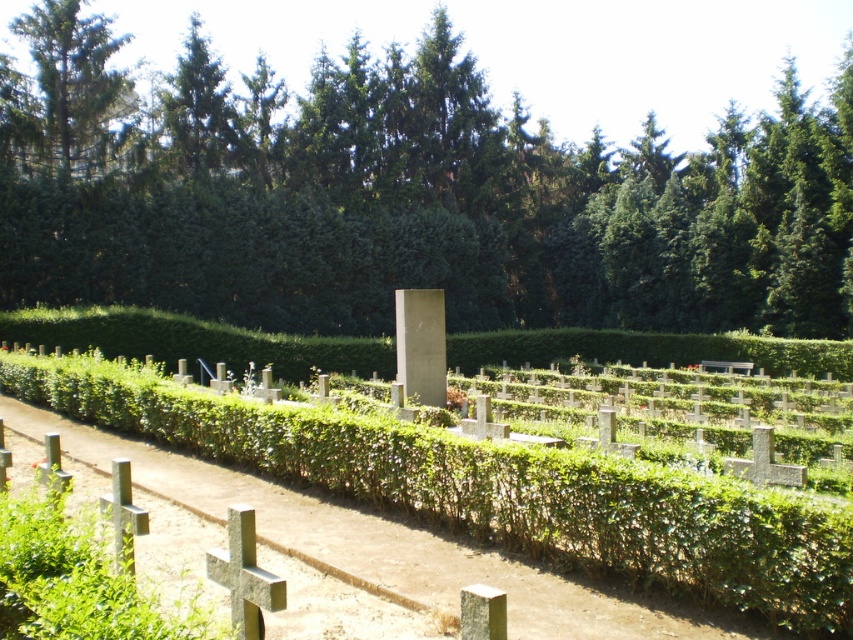
You are a visitor at the cemetery and want to take a photo of both the green hedge at center and the green textured tree at upper left. Based on their positions, which object should you focus on first to ensure both are in the frame?

The green hedge at center is below the green textured tree at upper left, so you should focus on the green textured tree at upper left first to ensure both are in the frame.

You are standing at the entrance of the cemetery and see two points marked in the image. The first point is at coordinates point (x=16, y=428) and the second point is at point (x=1, y=157). Which of these two points is closer to you?

Point (x=16, y=428) is in front of point (x=1, y=157), so the first point is closer to you.